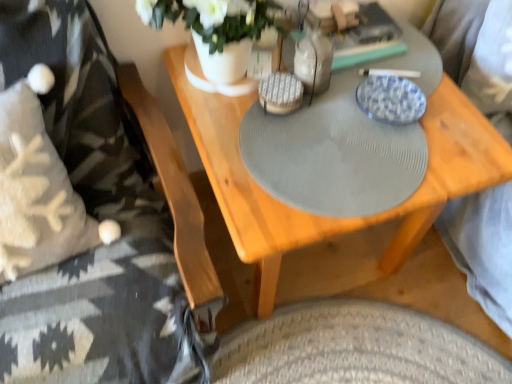
Find the location of a particular element. The image size is (512, 384). free spot to the right of blue glazed plate at upper center is located at coordinates (456, 118).